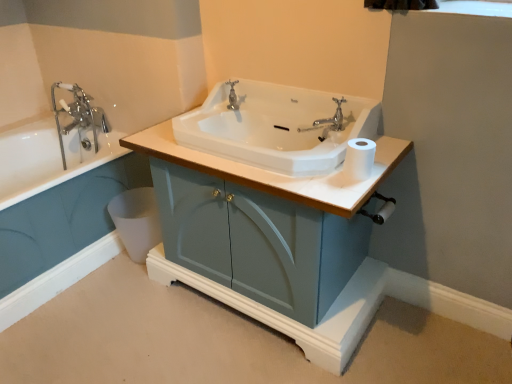
This screenshot has width=512, height=384. I want to click on free space to the left of white plastic toilet bowl at lower left, so click(104, 264).